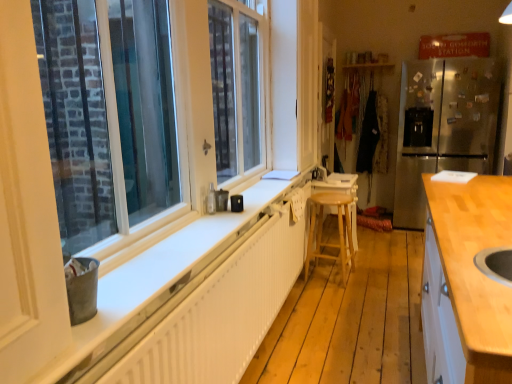
This screenshot has width=512, height=384. Find the location of `unoccupied region to the right of wooden stool at center`. unoccupied region to the right of wooden stool at center is located at coordinates 378,259.